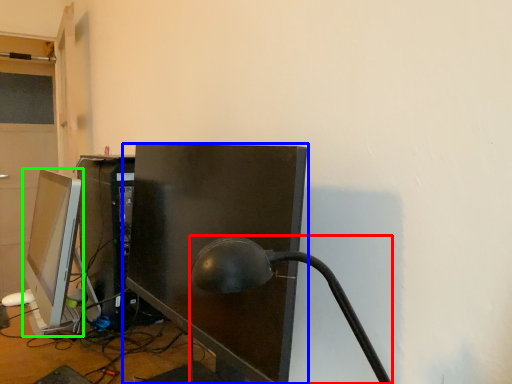
Question: Considering the real-world distances, which object is farthest from table lamp (highlighted by a red box)? computer monitor (highlighted by a blue box) or computer monitor (highlighted by a green box)?

Choices:
 (A) computer monitor
 (B) computer monitor

Answer: (B)